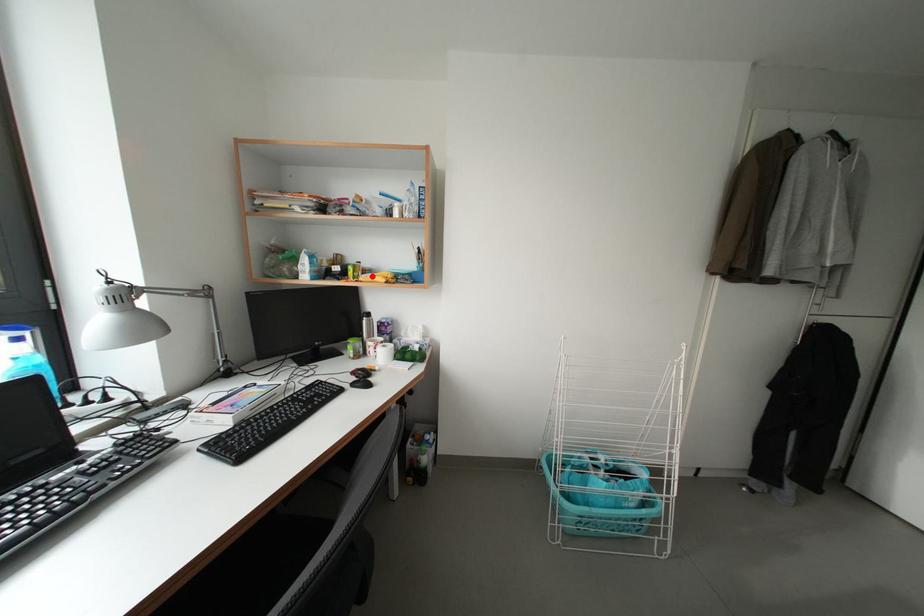
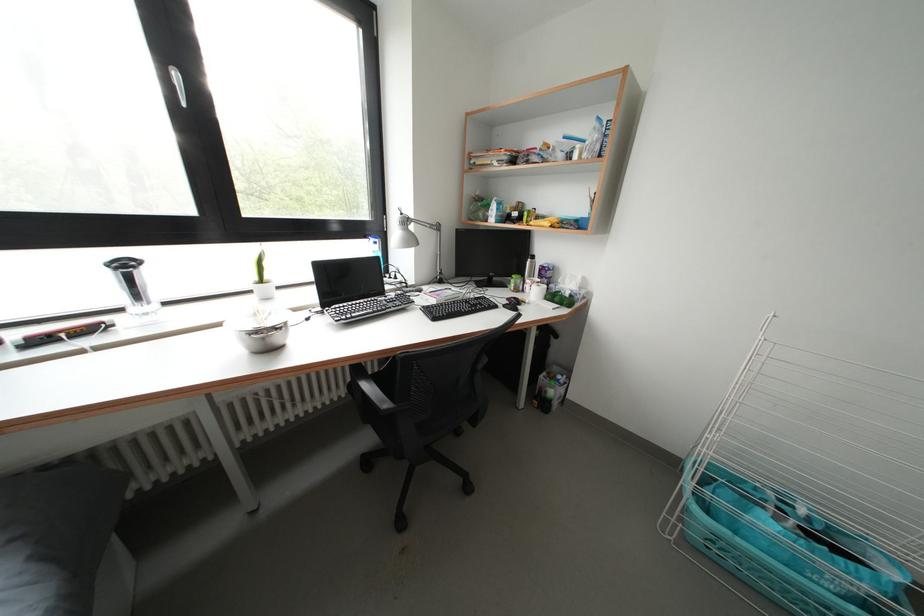
Question: I am providing you with two images of the same scene from different viewpoints. A red point is marked on the first image. Is the red point's position out of view in image 2?

Choices:
 (A) Yes
 (B) No

Answer: (B)